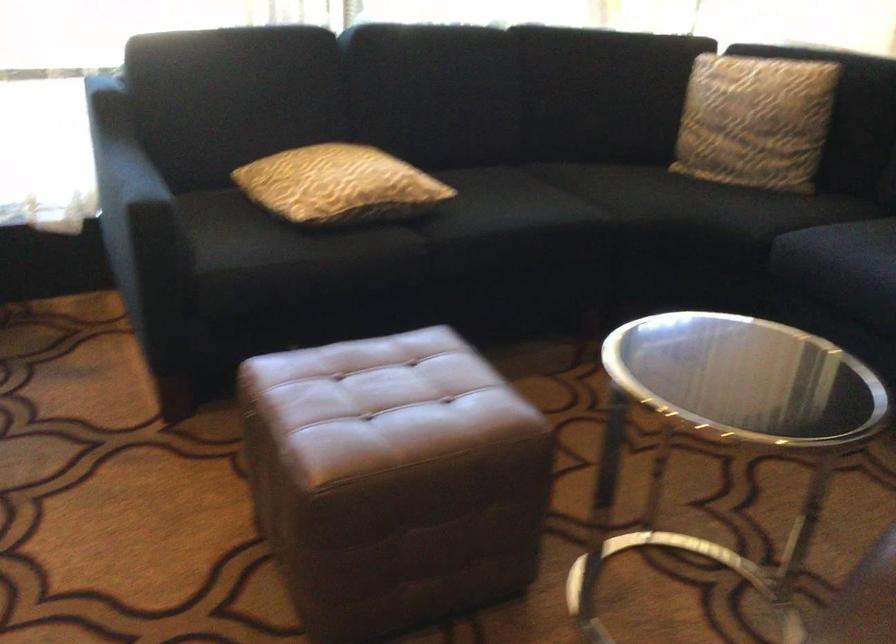
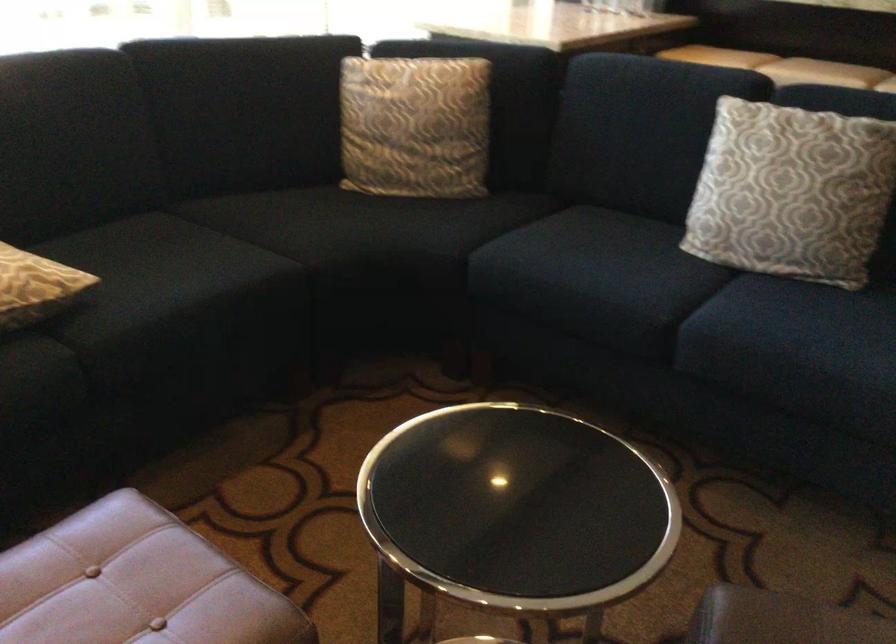
Question: Which direction would the cameraman need to move to produce the second image? Reply with the corresponding letter.

Choices:
 (A) Left
 (B) Right
 (C) Forward
 (D) Backward

Answer: (C)